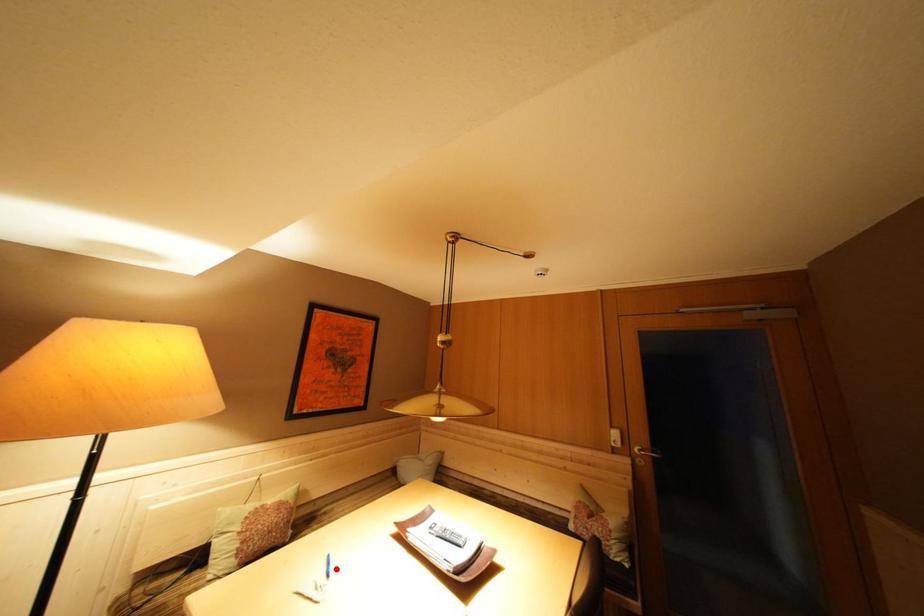
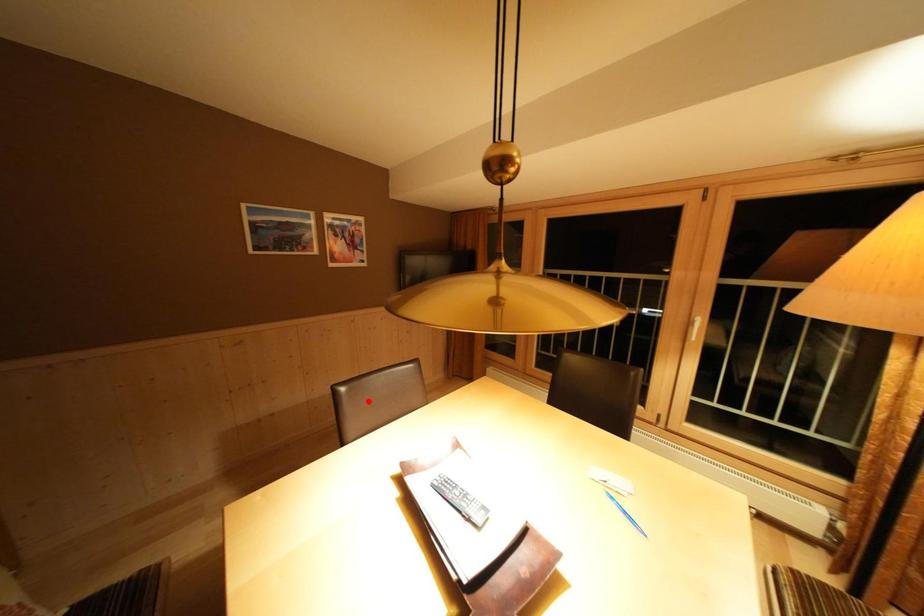
I am providing you with two images of the same scene from different viewpoints. A red point is marked on the first image and another point is marked on the second image. Is the marked point in image1 the same physical position as the marked point in image2?

No